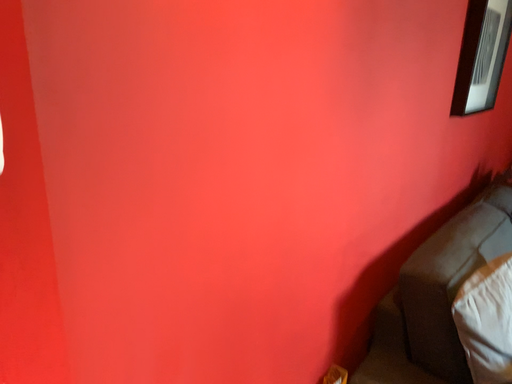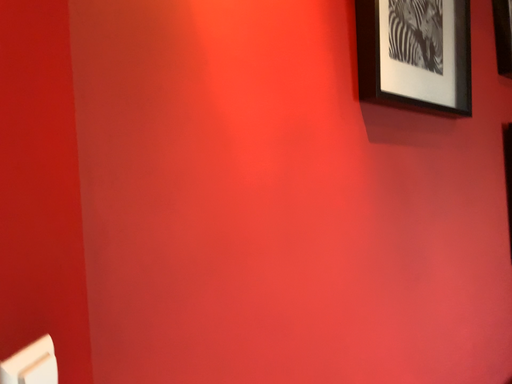
Question: How did the camera likely rotate when shooting the video?

Choices:
 (A) rotated right
 (B) rotated left

Answer: (B)